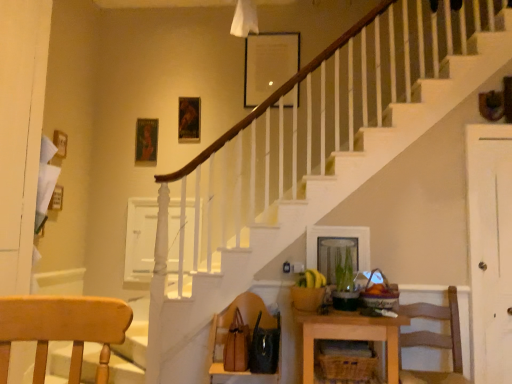
Question: In the image, is wooden chair at lower right, which ranks as the 1th chair in right-to-left order, on the left side or the right side of woven brown basket at lower center?

Choices:
 (A) right
 (B) left

Answer: (A)

Question: Based on their sizes in the image, would you say wooden chair at lower right, marked as the 2th chair in a left-to-right arrangement, is bigger or smaller than woven brown basket at lower center?

Choices:
 (A) small
 (B) big

Answer: (B)

Question: Based on their relative distances, which object is farther from the woven brown basket at lower center?

Choices:
 (A) brown leather handbag at lower center, the 1th chair when ordered from left to right
 (B) wooden table at lower center
 (C) wooden chair at lower right, marked as the 2th chair in a left-to-right arrangement
 (D) white wood door at right

Answer: (D)

Question: Which is farther from the woven brown basket at lower center?

Choices:
 (A) wooden table at lower center
 (B) white wood door at right
 (C) wooden chair at lower right, which ranks as the 1th chair in right-to-left order
 (D) brown leather handbag at lower center, which ranks as the 2th chair in right-to-left order

Answer: (B)